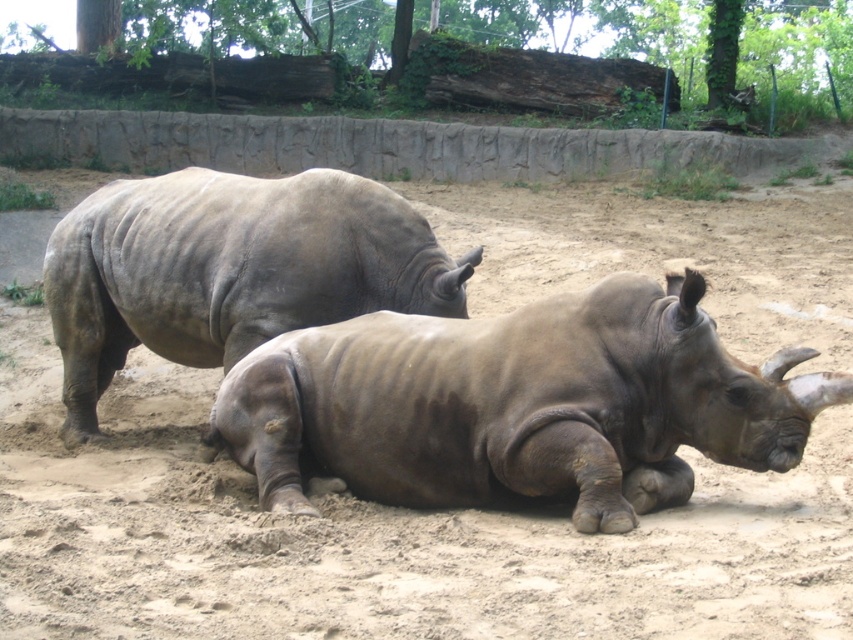
Question: Which of the following is the farthest from the observer?

Choices:
 (A) gray matte rhinoceros at center
 (B) matte gray rhino at lower center

Answer: (A)

Question: Which point is closer to the camera taking this photo?

Choices:
 (A) (364, 220)
 (B) (282, 438)

Answer: (B)

Question: Is matte gray rhino at lower center below gray matte rhinoceros at center?

Choices:
 (A) no
 (B) yes

Answer: (B)

Question: Can you confirm if matte gray rhino at lower center is positioned to the left of gray matte rhinoceros at center?

Choices:
 (A) yes
 (B) no

Answer: (B)

Question: Which object is farther from the camera taking this photo?

Choices:
 (A) gray matte rhinoceros at center
 (B) matte gray rhino at lower center

Answer: (A)

Question: Is matte gray rhino at lower center smaller than gray matte rhinoceros at center?

Choices:
 (A) yes
 (B) no

Answer: (A)